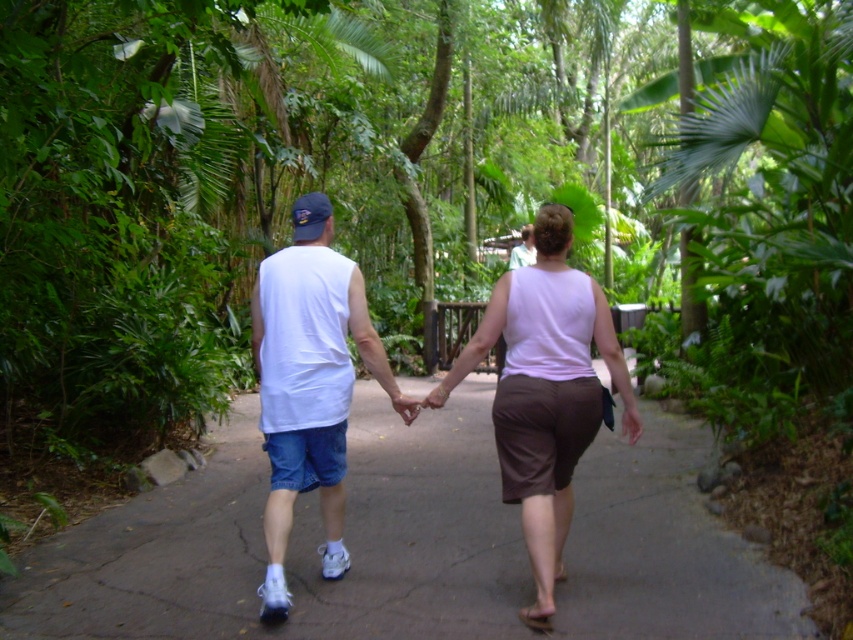
Question: From the image, what is the correct spatial relationship of gray concrete pavement at center in relation to light green fabric shirt at center?

Choices:
 (A) above
 (B) below

Answer: (B)

Question: Does white cotton tank top at center lie in front of light green fabric shirt at center?

Choices:
 (A) no
 (B) yes

Answer: (B)

Question: Considering the real-world distances, which object is farthest from the gray concrete pavement at center?

Choices:
 (A) light green fabric shirt at center
 (B) white matte tank top at center

Answer: (A)

Question: Among these points, which one is farthest from the camera?

Choices:
 (A) (318, 493)
 (B) (527, 250)

Answer: (B)

Question: Can you confirm if gray concrete pavement at center is positioned to the right of white cotton tank top at center?

Choices:
 (A) yes
 (B) no

Answer: (B)

Question: Based on their relative distances, which object is nearer to the gray concrete pavement at center?

Choices:
 (A) white matte tank top at center
 (B) light green fabric shirt at center

Answer: (A)